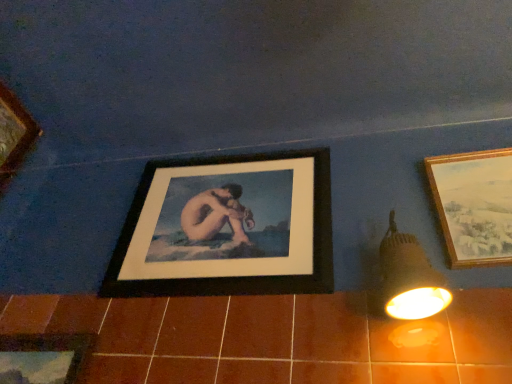
The image size is (512, 384). In order to click on free location above brown ceramic tile at lower center (from a real-world perspective) in this screenshot , I will do `click(207, 283)`.